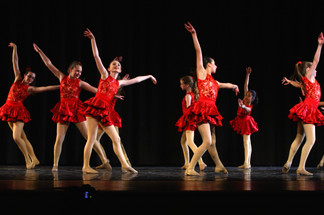
The width and height of the screenshot is (324, 215). In order to click on 1 light in this screenshot , I will do `click(47, 176)`.